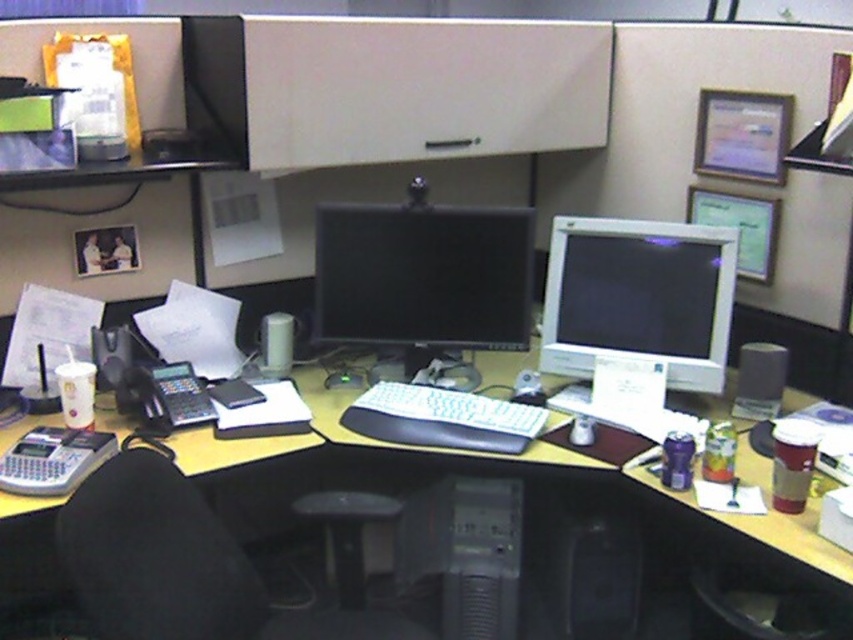
You are an office worker who just arrived at your desk. You see the black fabric swivel chair at center and the black glossy monitor at center. Which object is larger in size?

The black fabric swivel chair at center is bigger than the black glossy monitor at center.

You are standing at the point marked by coordinates point (143, 602) in the office cubicle. You want to move to the door located at the far end of the cubicle. Considering your height is 5.8 feet, will you hit your head on any part of the cubicle ceiling while walking towards the door?

The distance between point (143, 602) and the viewer is 4.60 feet. Since the cubicle ceiling height is not mentioned, it is impossible to determine if you will hit your head while walking towards the door.

You are an office worker who needs to reach for the black plastic mouse at center to turn on the black glossy monitor at center. Can you easily access the mouse without moving the monitor?

The black plastic mouse at center is behind the black glossy monitor at center, so you cannot easily access it without moving the monitor first.